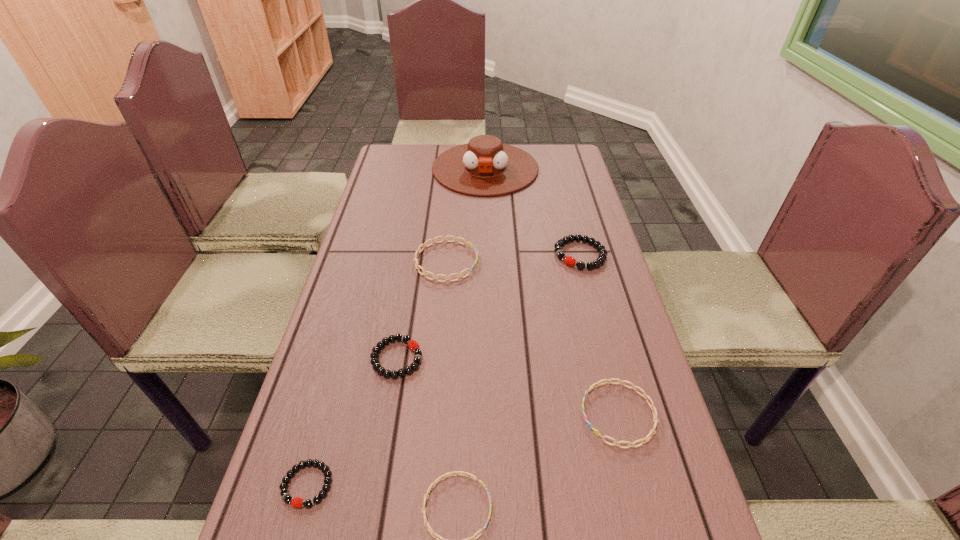
The image size is (960, 540). I want to click on the nearest black bracelet, so click(x=308, y=503).

You are a GUI agent. You are given a task and a screenshot of the screen. Output one action in this format:
    pyautogui.click(x=<x>, y=<y>)
    Task: Click on the vacant space located 0.260m on the front-facing side of the cowboy hat
    The height and width of the screenshot is (540, 960).
    Given the screenshot: What is the action you would take?
    pyautogui.click(x=487, y=247)

This screenshot has width=960, height=540. What are the coordinates of `vacant space situated 0.360m on the surface of the biggest blue bracelet showing star-shaped elements` in the screenshot? It's located at (607, 261).

I want to click on free space located on the front of the farthest black bracelet, so click(588, 285).

This screenshot has width=960, height=540. Identify the location of vacant region located on the surface of the second biggest blue bracelet showing star-shaped elements. (403, 414).

This screenshot has height=540, width=960. What are the coordinates of `vacant region located on the surface of the second biggest blue bracelet showing star-shaped elements` in the screenshot? It's located at (537, 414).

You are a GUI agent. You are given a task and a screenshot of the screen. Output one action in this format:
    pyautogui.click(x=<x>, y=<y>)
    Task: Click on the free space located 0.160m on the surface of the second biggest blue bracelet showing star-shaped elements
    
    Given the screenshot: What is the action you would take?
    pyautogui.click(x=502, y=414)

At what (x,y) coordinates should I click in order to perform the action: click on vacant region located 0.290m on the right of the fourth nearest object. Please return your answer as a coordinate pair (x, y). The image size is (960, 540). Looking at the image, I should click on pyautogui.click(x=552, y=358).

Find the location of `vacant space situated 0.370m on the right of the nearest black bracelet`. vacant space situated 0.370m on the right of the nearest black bracelet is located at coordinates (540, 484).

In order to click on object located at the far edge in this screenshot , I will do `click(484, 166)`.